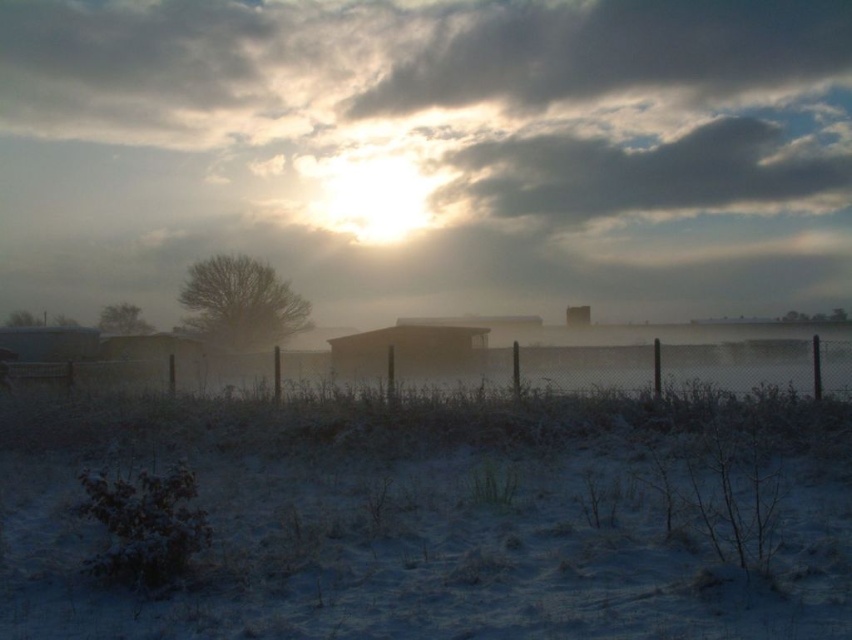
Question: Which point is farther to the camera?

Choices:
 (A) (775, 83)
 (B) (476, 339)

Answer: (A)

Question: Does dark gray cloud at upper center have a lesser width compared to brown matte hut at center?

Choices:
 (A) yes
 (B) no

Answer: (B)

Question: Does cloudy at upper center lie behind brown matte hut at center?

Choices:
 (A) yes
 (B) no

Answer: (A)

Question: Which point appears closest to the camera in this image?

Choices:
 (A) (557, 218)
 (B) (468, 356)

Answer: (B)

Question: Which object is closer to the camera taking this photo?

Choices:
 (A) cloudy at upper center
 (B) frosted glass morning fog at center
 (C) brown matte hut at center

Answer: (C)

Question: Can you confirm if dark gray cloud at upper center is smaller than brown matte hut at center?

Choices:
 (A) yes
 (B) no

Answer: (B)